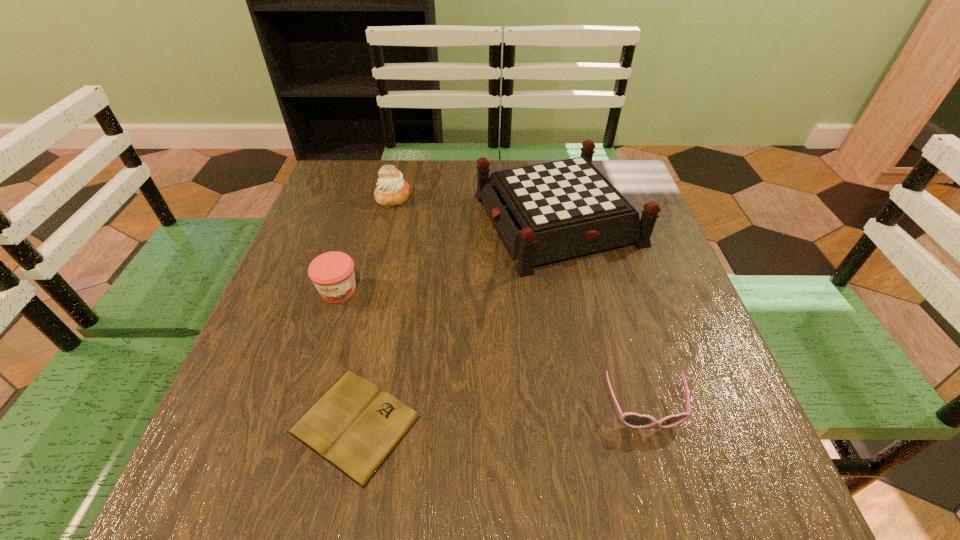
Find the location of a particular element. This screenshot has height=540, width=960. checkerboard at the far edge is located at coordinates (546, 212).

Locate an element on the screen. pastry present at the far edge is located at coordinates (392, 190).

Locate an element on the screen. The image size is (960, 540). object that is positioned at the near edge is located at coordinates (355, 426).

This screenshot has height=540, width=960. Find the location of `pastry situated at the left edge`. pastry situated at the left edge is located at coordinates (392, 190).

Image resolution: width=960 pixels, height=540 pixels. I want to click on jam situated at the left edge, so click(332, 273).

At what (x,y) coordinates should I click in order to perform the action: click on book at the left edge. Please return your answer as a coordinate pair (x, y). Looking at the image, I should click on (355, 426).

Identify the location of checkerboard located in the right edge section of the desktop. This screenshot has height=540, width=960. (546, 212).

This screenshot has width=960, height=540. In order to click on sunglasses that is at the right edge in this screenshot , I will do `click(631, 419)`.

You are a GUI agent. You are given a task and a screenshot of the screen. Output one action in this format:
    pyautogui.click(x=<x>, y=<y>)
    Task: Click on the object that is at the far left corner
    Image resolution: width=960 pixels, height=540 pixels.
    Given the screenshot: What is the action you would take?
    pyautogui.click(x=392, y=190)

You are a GUI agent. You are given a task and a screenshot of the screen. Output one action in this format:
    pyautogui.click(x=<x>, y=<y>)
    Task: Click on the object at the near left corner
    
    Given the screenshot: What is the action you would take?
    pyautogui.click(x=355, y=426)